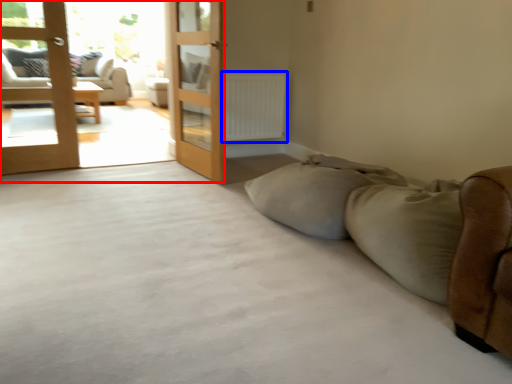
Question: Which object is further to the camera taking this photo, terrace (highlighted by a red box) or radiator (highlighted by a blue box)?

Choices:
 (A) terrace
 (B) radiator

Answer: (B)